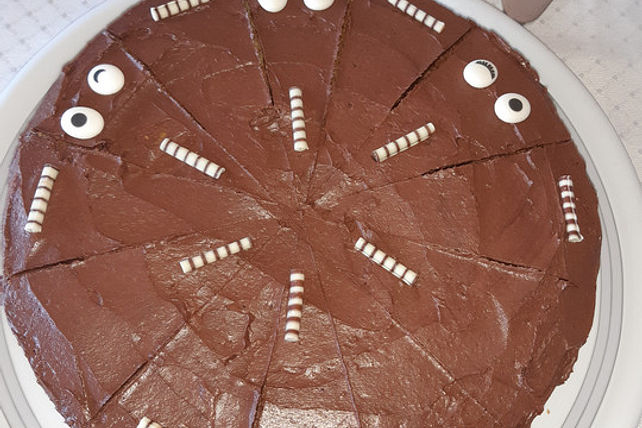
Image resolution: width=642 pixels, height=428 pixels. What are the coordinates of `gray inner rim of serving plate` in the screenshot? It's located at (598, 388), (13, 407).